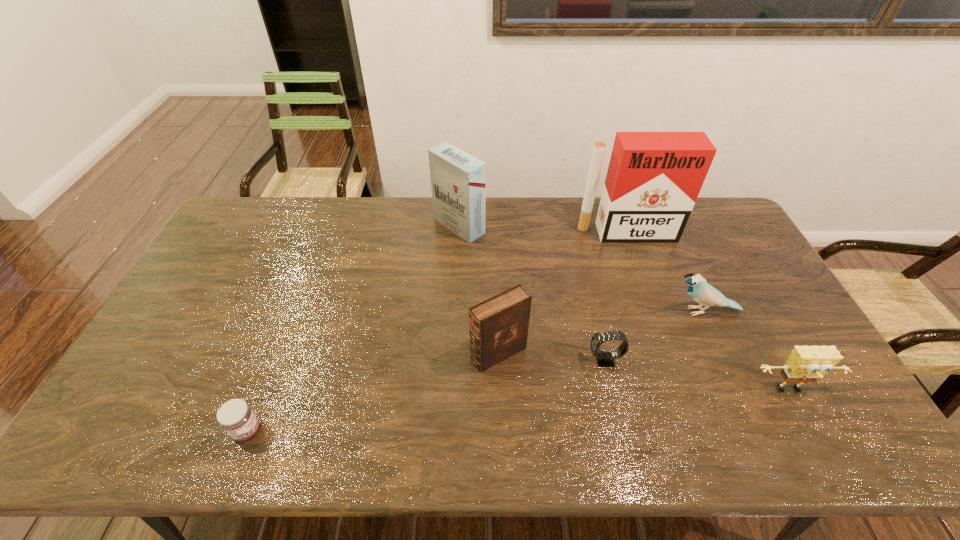
Image resolution: width=960 pixels, height=540 pixels. Identify the location of vacant space located on the front label of the nearest object. (316, 430).

You are a GUI agent. You are given a task and a screenshot of the screen. Output one action in this format:
    pyautogui.click(x=<x>, y=<y>)
    Task: Click on the object present at the near edge
    
    Given the screenshot: What is the action you would take?
    pyautogui.click(x=236, y=417)

Where is `bird situated at the right edge`? The height and width of the screenshot is (540, 960). bird situated at the right edge is located at coordinates (699, 290).

Locate an element on the screen. This screenshot has height=540, width=960. sponge at the right edge is located at coordinates (806, 364).

I want to click on free space at the far edge of the desktop, so click(x=556, y=202).

Find the location of a particular element. The image size is (960, 540). vacant space at the near edge is located at coordinates (581, 440).

Where is `free spot at the left edge of the desktop`? This screenshot has height=540, width=960. free spot at the left edge of the desktop is located at coordinates (x=173, y=390).

Identify the location of blank space at the right edge of the desktop. The height and width of the screenshot is (540, 960). (721, 278).

The width and height of the screenshot is (960, 540). What are the coordinates of `vacant area between the second nearest object and the Bible` in the screenshot? It's located at (644, 373).

This screenshot has height=540, width=960. I want to click on free space between the sixth shortest object and the sixth tallest object, so click(532, 293).